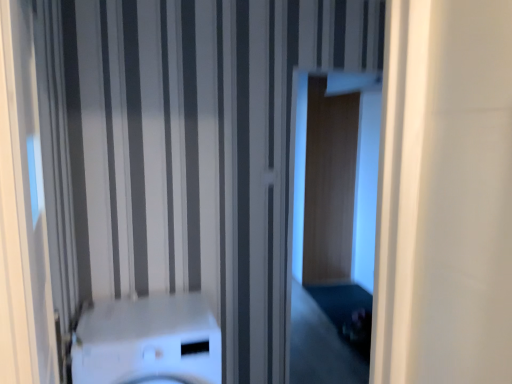
Describe the element at coordinates (148, 342) in the screenshot. I see `white glossy washer at center` at that location.

This screenshot has width=512, height=384. Identify the location of white glossy washer at center. tap(148, 342).

Find the location of `transparent glass door at center`. transparent glass door at center is located at coordinates (334, 219).

The height and width of the screenshot is (384, 512). What do you see at coordinates (334, 219) in the screenshot? I see `transparent glass door at center` at bounding box center [334, 219].

The width and height of the screenshot is (512, 384). What are the coordinates of `white glossy washer at center` in the screenshot? It's located at (148, 342).

Between white glossy washer at center and transparent glass door at center, which one appears on the left side from the viewer's perspective?

white glossy washer at center is more to the left.

In the image, is white glossy washer at center positioned in front of or behind transparent glass door at center?

Clearly, white glossy washer at center is in front of transparent glass door at center.

Is point (140, 365) closer or farther from the camera than point (328, 214)?

Clearly, point (140, 365) is closer to the camera than point (328, 214).

From the image's perspective, is white glossy washer at center located above transparent glass door at center?

No.

From a real-world perspective, is white glossy washer at center physically above transparent glass door at center?

No, from a real-world perspective, white glossy washer at center is not on top of transparent glass door at center.

Is white glossy washer at center wider than transparent glass door at center?

Yes.

Is white glossy washer at center taller or shorter than transparent glass door at center?

white glossy washer at center is shorter than transparent glass door at center.

Who is smaller, white glossy washer at center or transparent glass door at center?

white glossy washer at center is smaller.

Would you say transparent glass door at center is part of white glossy washer at center's contents?

Definitely not — transparent glass door at center is not inside white glossy washer at center.

Are white glossy washer at center and transparent glass door at center far apart?

white glossy washer at center is far away from transparent glass door at center.

Is white glossy washer at center facing away from transparent glass door at center?

white glossy washer at center is not turned away from transparent glass door at center.

What's the angular difference between white glossy washer at center and transparent glass door at center's facing directions?

They differ by 3.17 degrees in their facing directions.

In order to click on screen door located behind the white glossy washer at center in this screenshot , I will do `click(334, 219)`.

Does transparent glass door at center appear on the right side of white glossy washer at center?

Yes, transparent glass door at center is to the right of white glossy washer at center.

Which is in front, transparent glass door at center or white glossy washer at center?

white glossy washer at center is in front.

Is point (334, 353) positioned before point (125, 331)?

No, (334, 353) is further to viewer.

From the image's perspective, who appears lower, transparent glass door at center or white glossy washer at center?

white glossy washer at center.

From a real-world perspective, is transparent glass door at center positioned above or below white glossy washer at center?

In terms of real-world spatial position, transparent glass door at center is above white glossy washer at center.

Consider the image. Is transparent glass door at center wider than white glossy washer at center?

Incorrect, the width of transparent glass door at center does not surpass that of white glossy washer at center.

Considering the relative sizes of transparent glass door at center and white glossy washer at center in the image provided, is transparent glass door at center taller than white glossy washer at center?

Yes, transparent glass door at center is taller than white glossy washer at center.

Considering the sizes of objects transparent glass door at center and white glossy washer at center in the image provided, who is smaller, transparent glass door at center or white glossy washer at center?

white glossy washer at center.

Do you think transparent glass door at center is within white glossy washer at center, or outside of it?

→ transparent glass door at center is not inside white glossy washer at center, it's outside.

Is transparent glass door at center in contact with white glossy washer at center?

transparent glass door at center and white glossy washer at center are clearly separated.

Is transparent glass door at center facing towards white glossy washer at center?

No.

Identify the location of washer that is on the left side of transparent glass door at center. (148, 342).

This screenshot has height=384, width=512. Find the location of `washer that appears in front of the transparent glass door at center`. washer that appears in front of the transparent glass door at center is located at coordinates (148, 342).

This screenshot has width=512, height=384. Find the location of `screen door above the white glossy washer at center (from a real-world perspective)`. screen door above the white glossy washer at center (from a real-world perspective) is located at coordinates (334, 219).